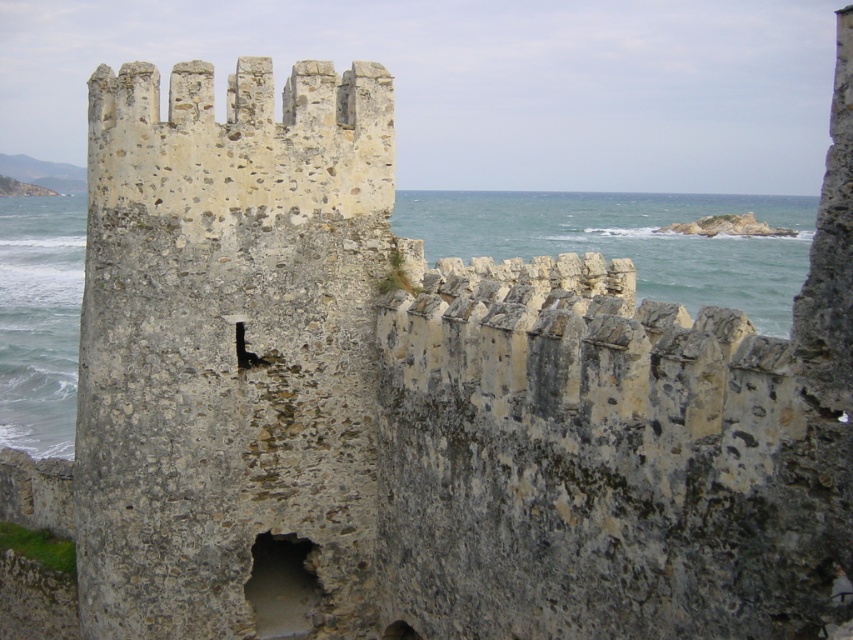
Does clear water at center appear on the right side of dark gray stone hole at center?

Incorrect, clear water at center is not on the right side of dark gray stone hole at center.

Does clear water at center have a smaller size compared to dark gray stone hole at center?

No, clear water at center is not smaller than dark gray stone hole at center.

Between point (57, 198) and point (260, 602), which one is positioned in front?

Point (260, 602)

Where is `clear water at center`? This screenshot has width=853, height=640. clear water at center is located at coordinates (630, 241).